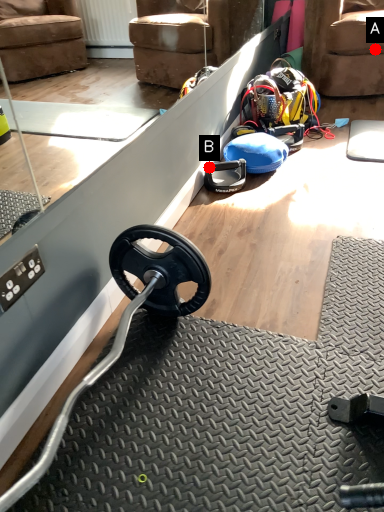
Question: Two points are circled on the image, labeled by A and B beside each circle. Which point appears farthest from the camera in this image?

Choices:
 (A) A is further
 (B) B is further

Answer: (A)